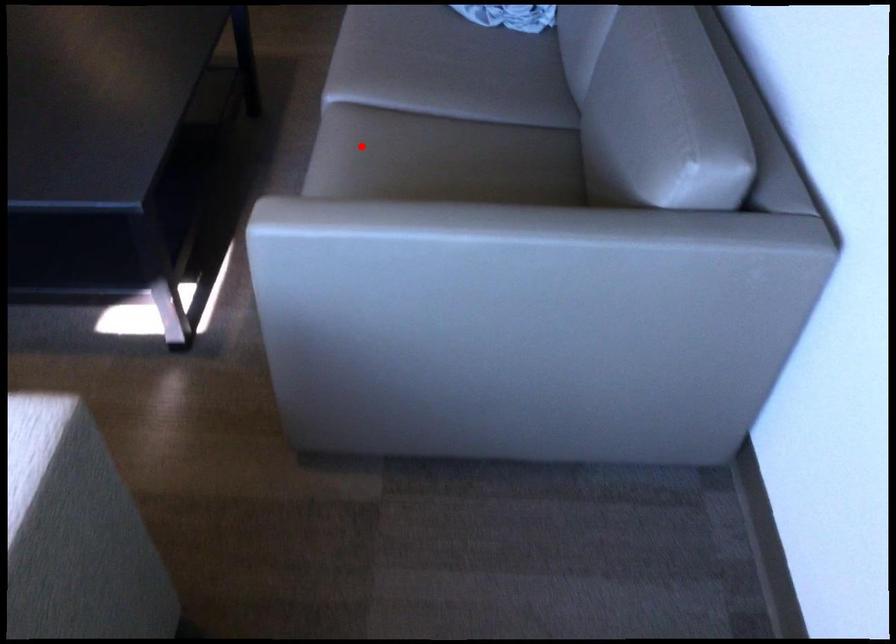
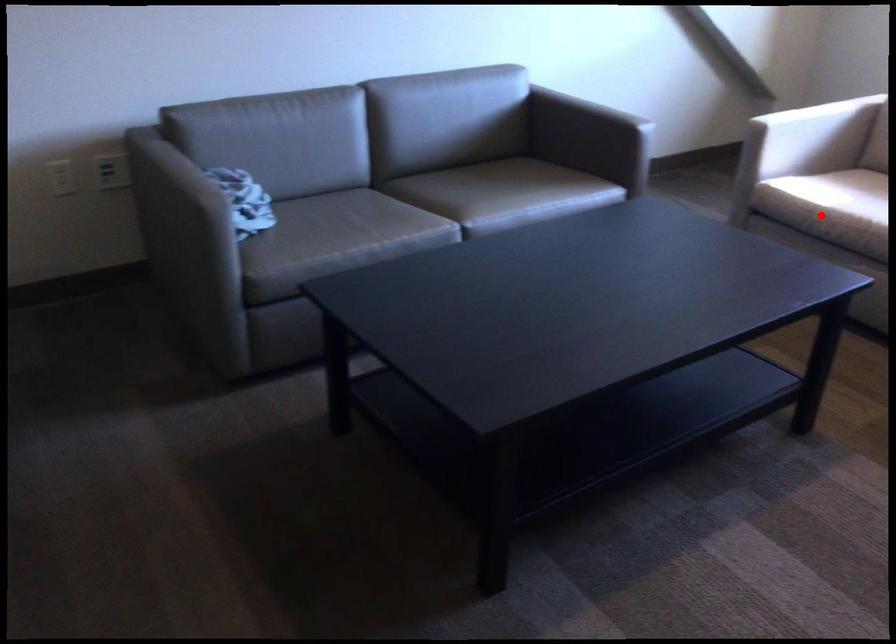
I am providing you with two images of the same scene from different viewpoints. A red point is marked on the first image and another point is marked on the second image. Do the highlighted points in image1 and image2 indicate the same real-world spot?

No